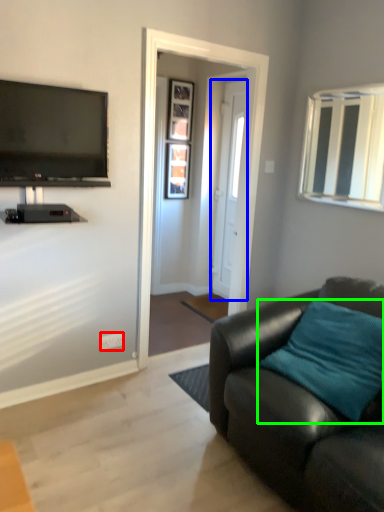
Question: Considering the real-world distances, which object is closest to power outlet (highlighted by a red box)? door (highlighted by a blue box) or pillow (highlighted by a green box).

Choices:
 (A) door
 (B) pillow

Answer: (B)